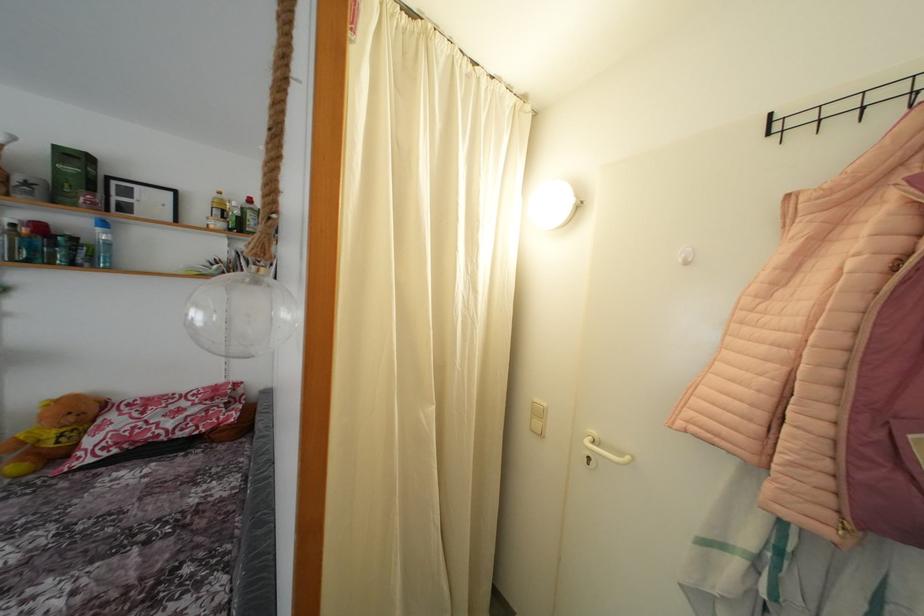
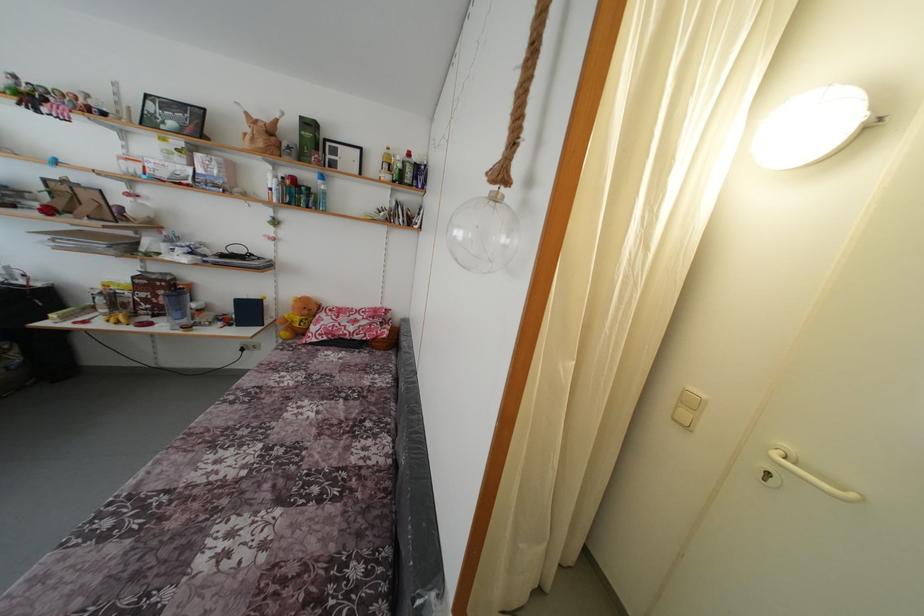
Question: The first image is from the beginning of the video and the second image is from the end. How did the camera likely rotate when shooting the video?

Choices:
 (A) Left
 (B) Right
 (C) Up
 (D) Down

Answer: (A)